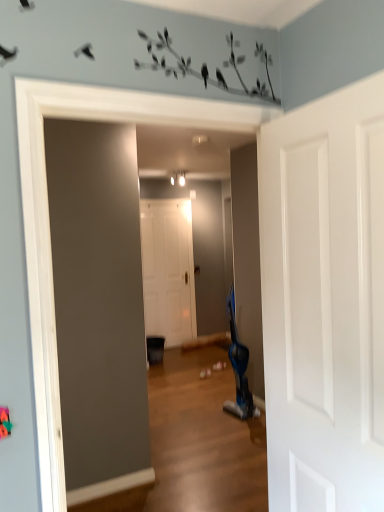
The width and height of the screenshot is (384, 512). In order to click on blank area to the left of blue plastic swivel chair at center-right in this screenshot , I will do coord(213,412).